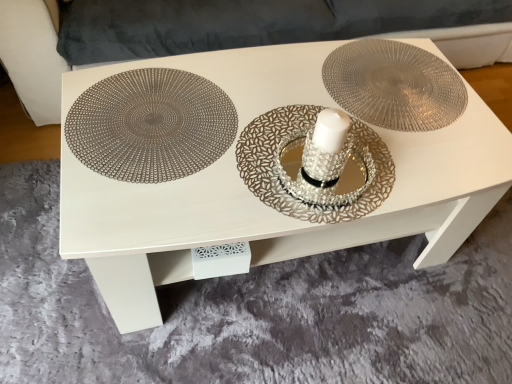
This screenshot has height=384, width=512. What are the coordinates of `free space above metallic placemat at center (from a real-world perspective)` in the screenshot? It's located at (291, 120).